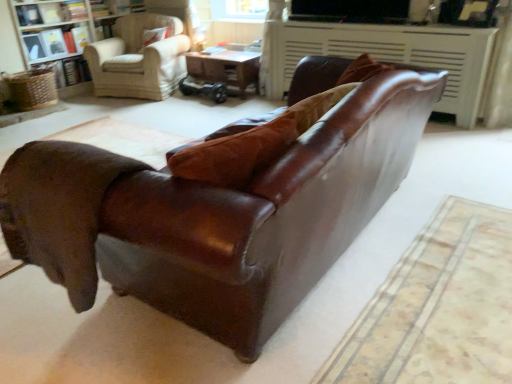
Question: Should I look upward or downward to see brown leather fireplace at upper center?

Choices:
 (A) up
 (B) down

Answer: (A)

Question: Is brown leather fireplace at upper center closer to camera compared to white textured bookcase at upper left?

Choices:
 (A) no
 (B) yes

Answer: (B)

Question: Considering the relative sizes of brown leather fireplace at upper center and white textured bookcase at upper left in the image provided, is brown leather fireplace at upper center bigger than white textured bookcase at upper left?

Choices:
 (A) yes
 (B) no

Answer: (B)

Question: From the image's perspective, does brown leather fireplace at upper center appear lower than white textured bookcase at upper left?

Choices:
 (A) no
 (B) yes

Answer: (B)

Question: Is brown leather fireplace at upper center taller than white textured bookcase at upper left?

Choices:
 (A) no
 (B) yes

Answer: (A)

Question: Is brown leather fireplace at upper center not inside white textured bookcase at upper left?

Choices:
 (A) yes
 (B) no

Answer: (A)

Question: From a real-world perspective, does brown leather fireplace at upper center stand above white textured bookcase at upper left?

Choices:
 (A) no
 (B) yes

Answer: (A)

Question: From the image's perspective, is light beige fabric armchair at upper left on shiny brown leather couch at center?

Choices:
 (A) yes
 (B) no

Answer: (A)

Question: Is light beige fabric armchair at upper left to the right of shiny brown leather couch at center from the viewer's perspective?

Choices:
 (A) yes
 (B) no

Answer: (B)

Question: Does light beige fabric armchair at upper left lie in front of shiny brown leather couch at center?

Choices:
 (A) yes
 (B) no

Answer: (B)

Question: Considering the relative sizes of light beige fabric armchair at upper left and shiny brown leather couch at center in the image provided, is light beige fabric armchair at upper left taller than shiny brown leather couch at center?

Choices:
 (A) yes
 (B) no

Answer: (B)

Question: Does light beige fabric armchair at upper left have a greater width compared to shiny brown leather couch at center?

Choices:
 (A) yes
 (B) no

Answer: (B)

Question: Is the position of light beige fabric armchair at upper left more distant than that of shiny brown leather couch at center?

Choices:
 (A) yes
 (B) no

Answer: (A)

Question: Does white textured bookcase at upper left appear on the right side of wooden table at center?

Choices:
 (A) yes
 (B) no

Answer: (B)